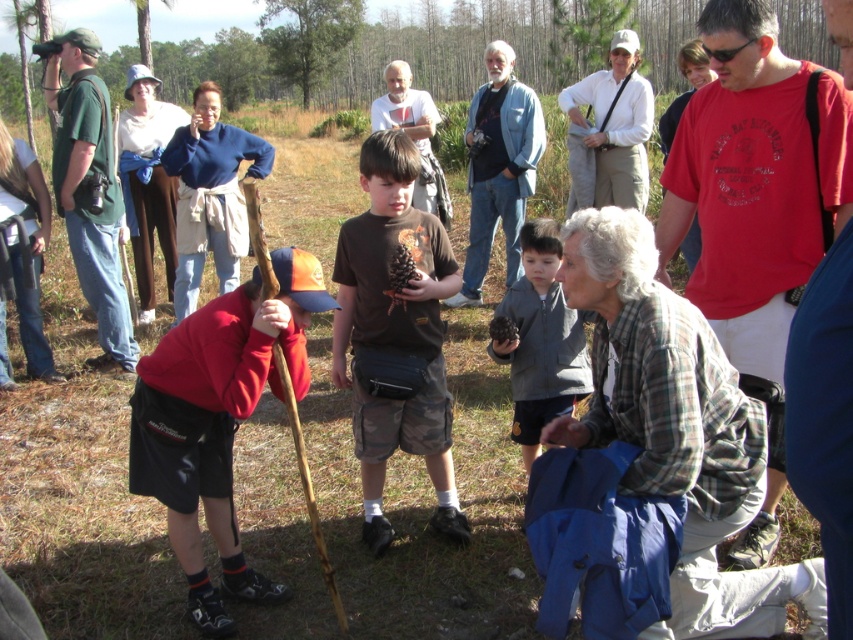
In the scene shown: Can you confirm if matte red t-shirt at center is positioned to the left of denim jacket at upper center?

Incorrect, matte red t-shirt at center is not on the left side of denim jacket at upper center.

Between matte red t-shirt at center and denim jacket at upper center, which one has more height?

With more height is denim jacket at upper center.

Describe the element at coordinates (753, 182) in the screenshot. I see `matte red t-shirt at center` at that location.

You are a GUI agent. You are given a task and a screenshot of the screen. Output one action in this format:
    pyautogui.click(x=<x>, y=<y>)
    Task: Click on the matte red t-shirt at center
    The image size is (853, 640).
    Given the screenshot: What is the action you would take?
    pyautogui.click(x=753, y=182)

Does white cotton shirt at center have a larger size compared to green leafy tree at upper center?

Yes, white cotton shirt at center is bigger than green leafy tree at upper center.

Is point (585, 124) closer to camera compared to point (300, 84)?

Yes, it is.

Locate an element on the screen. This screenshot has width=853, height=640. white cotton shirt at center is located at coordinates (611, 129).

Does green cotton shirt at left come behind gray fleece jacket at center?

That is True.

What do you see at coordinates (88, 188) in the screenshot?
I see `green cotton shirt at left` at bounding box center [88, 188].

Locate an element on the screen. The width and height of the screenshot is (853, 640). green cotton shirt at left is located at coordinates click(88, 188).